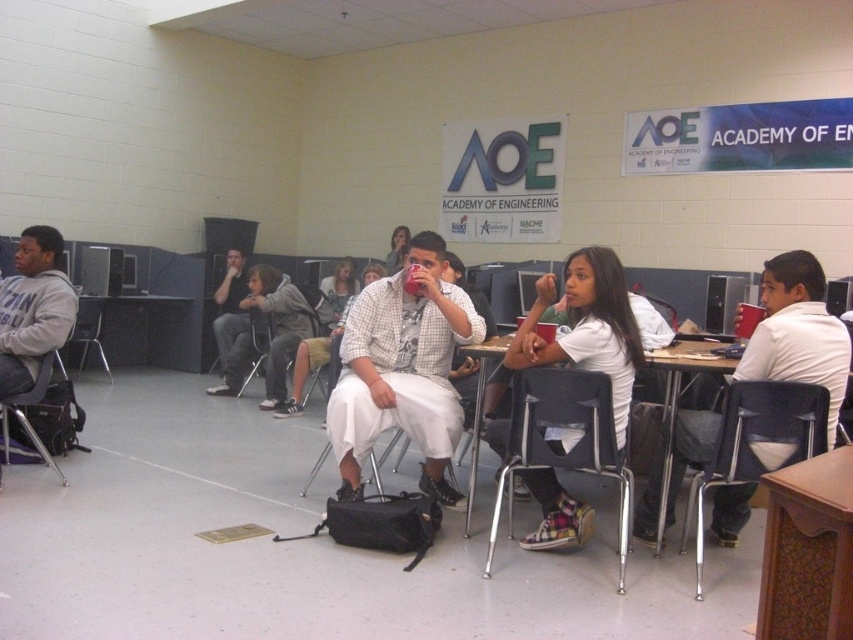
Question: Where is wooden table at lower right located in relation to gray hoodie at left in the image?

Choices:
 (A) left
 (B) right

Answer: (B)

Question: Can you confirm if gray hoodie at left is positioned above black plastic table at center?

Choices:
 (A) no
 (B) yes

Answer: (B)

Question: Which object appears closest to the camera in this image?

Choices:
 (A) white cotton shirt at center
 (B) checkered fabric shirt at center

Answer: (A)

Question: Does black plastic chair at lower center appear on the left side of metallic silver chair at left?

Choices:
 (A) no
 (B) yes

Answer: (A)

Question: Which of the following is the closest to the observer?

Choices:
 (A) black plastic chair at lower center
 (B) gray hoodie at left
 (C) white cotton shirt at center

Answer: (A)

Question: Which of these objects is positioned farthest from the white matte shirt at center?

Choices:
 (A) white cotton shirt at center
 (B) black plastic table at center
 (C) checkered fabric shirt at center

Answer: (B)